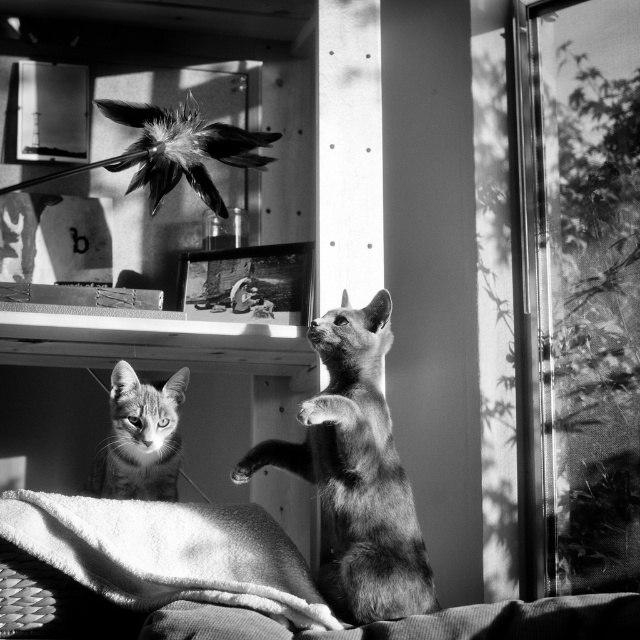
Looking at this image, can you confirm if soft white towel at lower left is shorter than tabby fur cat at lower left?

Yes.

Where is `soft white towel at lower left`? The width and height of the screenshot is (640, 640). soft white towel at lower left is located at coordinates (168, 552).

Between soft fur cat at center and soft white towel at lower left, which one has more height?

soft fur cat at center is taller.

Who is positioned more to the left, soft fur cat at center or soft white towel at lower left?

Positioned to the left is soft white towel at lower left.

This screenshot has height=640, width=640. Describe the element at coordinates (356, 474) in the screenshot. I see `soft fur cat at center` at that location.

Where is `soft fur cat at center`? The height and width of the screenshot is (640, 640). soft fur cat at center is located at coordinates (356, 474).

Which is below, transparent mesh at right or soft fur cat at center?

soft fur cat at center is lower down.

Is transparent mesh at right shorter than soft fur cat at center?

Incorrect, transparent mesh at right's height does not fall short of soft fur cat at center's.

Between point (612, 420) and point (368, 419), which one is positioned behind?

Point (612, 420)

Identify the location of transparent mesh at right. (582, 285).